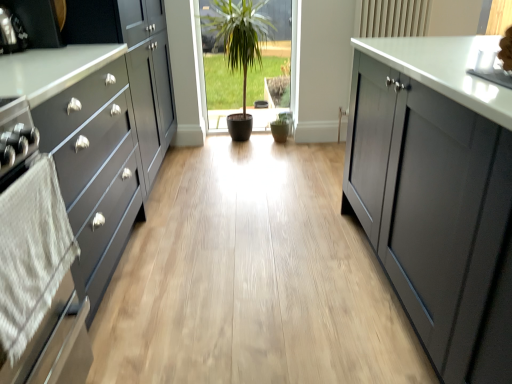
Question: Considering the relative sizes of white textured towel at left and green matte potted plant at center in the image provided, is white textured towel at left wider than green matte potted plant at center?

Choices:
 (A) no
 (B) yes

Answer: (A)

Question: From the image's perspective, is white textured towel at left above green matte potted plant at center?

Choices:
 (A) yes
 (B) no

Answer: (B)

Question: Is there a large distance between white textured towel at left and green matte potted plant at center?

Choices:
 (A) no
 (B) yes

Answer: (B)

Question: Is white textured towel at left aimed at green matte potted plant at center?

Choices:
 (A) no
 (B) yes

Answer: (A)

Question: Is white textured towel at left looking in the opposite direction of green matte potted plant at center?

Choices:
 (A) yes
 (B) no

Answer: (B)

Question: Is green matte potted plant at center completely or partially inside white textured towel at left?

Choices:
 (A) yes
 (B) no

Answer: (B)

Question: Is matte black oven at left a part of white textured towel at left?

Choices:
 (A) yes
 (B) no

Answer: (B)

Question: Is white textured towel at left further to the viewer compared to matte black oven at left?

Choices:
 (A) yes
 (B) no

Answer: (B)

Question: Is white textured towel at left taller than matte black oven at left?

Choices:
 (A) yes
 (B) no

Answer: (A)

Question: Is white textured towel at left oriented towards matte black oven at left?

Choices:
 (A) yes
 (B) no

Answer: (B)

Question: Is white textured towel at left bigger than matte black oven at left?

Choices:
 (A) yes
 (B) no

Answer: (B)

Question: Can you confirm if white textured towel at left is smaller than matte black oven at left?

Choices:
 (A) yes
 (B) no

Answer: (A)

Question: Is matte black cabinet at left not inside white textured towel at left?

Choices:
 (A) no
 (B) yes

Answer: (B)